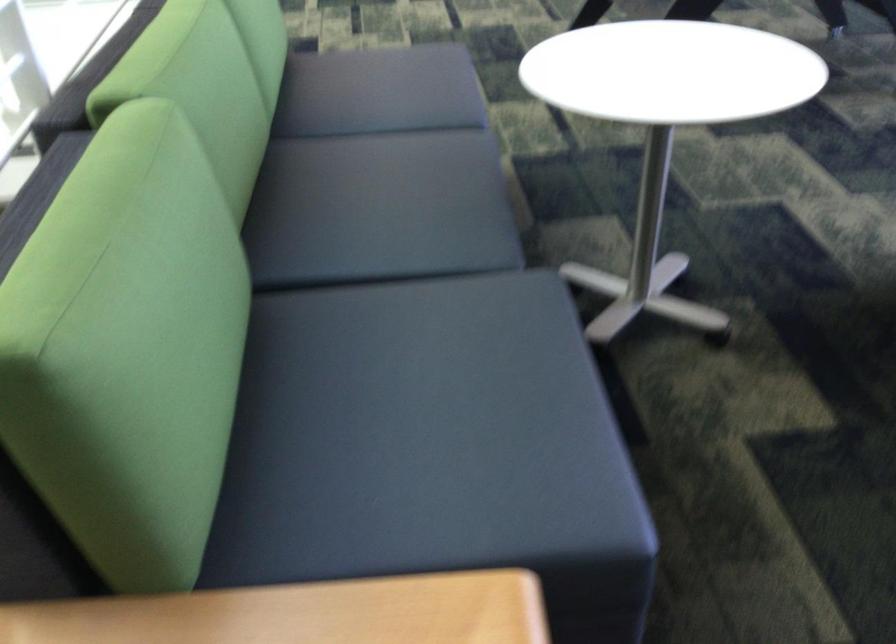
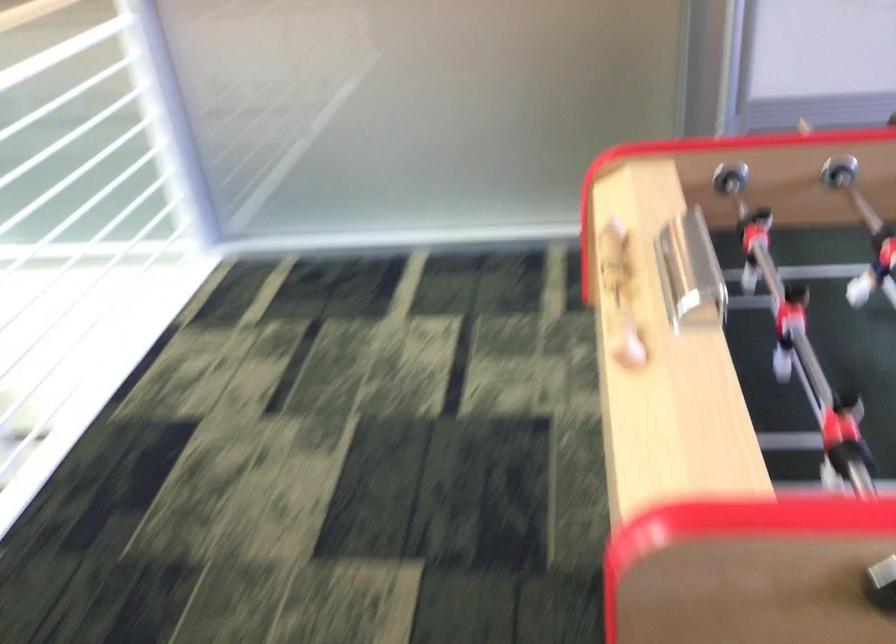
Question: The images are taken continuously from a first-person perspective. In which direction are you moving?

Choices:
 (A) Left
 (B) Right
 (C) Forward
 (D) Backward

Answer: (C)